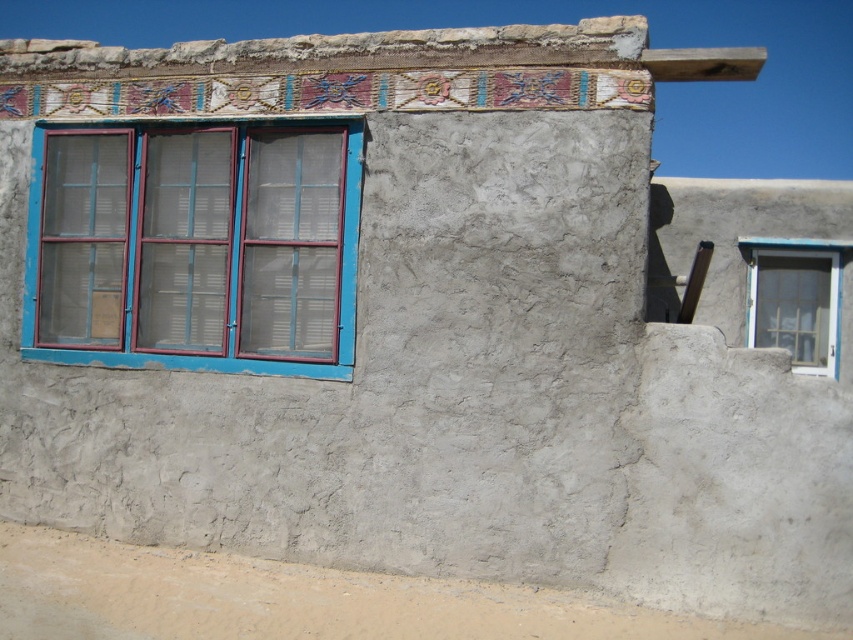
Question: From the image, what is the correct spatial relationship of blue painted wood window at left in relation to white painted wood window at right?

Choices:
 (A) above
 (B) below

Answer: (A)

Question: Considering the relative positions of blue painted wood window at left and white painted wood window at right in the image provided, where is blue painted wood window at left located with respect to white painted wood window at right?

Choices:
 (A) above
 (B) below

Answer: (A)

Question: Which point is farther from the camera taking this photo?

Choices:
 (A) (788, 250)
 (B) (254, 346)

Answer: (A)

Question: Which point is farther to the camera?

Choices:
 (A) (155, 266)
 (B) (822, 321)

Answer: (B)

Question: Does blue painted wood window at left appear under white painted wood window at right?

Choices:
 (A) yes
 (B) no

Answer: (B)